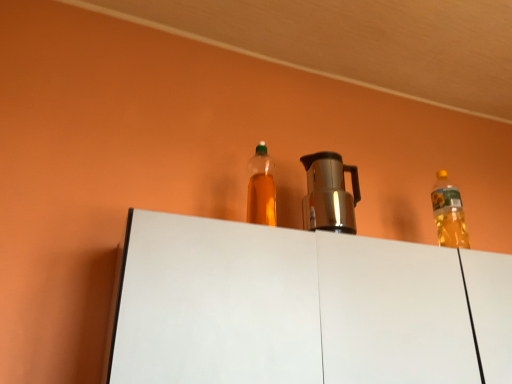
Locate an element on the screen. Image resolution: width=512 pixels, height=384 pixels. satin silver coffee pot at center is located at coordinates (329, 194).

Does translucent plastic bottle at center have a greater height compared to white matte cabinet at center?

No.

How many degrees apart are the facing directions of translucent plastic bottle at center and white matte cabinet at center?

The angle between the facing direction of translucent plastic bottle at center and the facing direction of white matte cabinet at center is 0.877 degrees.

Is translucent plastic bottle at center thinner than white matte cabinet at center?

Indeed, translucent plastic bottle at center has a lesser width compared to white matte cabinet at center.

From a real-world perspective, is translucent plastic bottle at center on top of white matte cabinet at center?

Yes, from a real-world perspective, translucent plastic bottle at center is on top of white matte cabinet at center.

Who is smaller, translucent plastic bottle at center or satin silver coffee pot at center?

Smaller between the two is translucent plastic bottle at center.

Can you tell me how much translucent plastic bottle at center and satin silver coffee pot at center differ in facing direction?

The facing directions of translucent plastic bottle at center and satin silver coffee pot at center are 0.551 degrees apart.

From the picture: From the image's perspective, is translucent plastic bottle at center positioned above or below satin silver coffee pot at center?

Based on their image positions, translucent plastic bottle at center is located above satin silver coffee pot at center.

Is translucent plastic bottle at center in front of or behind satin silver coffee pot at center in the image?

translucent plastic bottle at center is positioned closer to the viewer than satin silver coffee pot at center.

Is white matte cabinet at center looking in the opposite direction of satin silver coffee pot at center?

That's not correct — white matte cabinet at center is not looking away from satin silver coffee pot at center.

Which of these two, white matte cabinet at center or satin silver coffee pot at center, is thinner?

satin silver coffee pot at center.

Which object is further away from the camera, white matte cabinet at center or satin silver coffee pot at center?

satin silver coffee pot at center is further from the camera.

Considering the relative sizes of white matte cabinet at center and satin silver coffee pot at center in the image provided, is white matte cabinet at center shorter than satin silver coffee pot at center?

No.

From a real-world perspective, is satin silver coffee pot at center above or below white matte cabinet at center?

Clearly, from a real-world perspective, satin silver coffee pot at center is above white matte cabinet at center.

Based on the photo, can you confirm if satin silver coffee pot at center is positioned to the right of white matte cabinet at center?

No, satin silver coffee pot at center is not to the right of white matte cabinet at center.

In the scene shown: Is satin silver coffee pot at center beside white matte cabinet at center?

No.

Does satin silver coffee pot at center have a greater width compared to white matte cabinet at center?

No, satin silver coffee pot at center is not wider than white matte cabinet at center.

Locate an element on the screen. This screenshot has width=512, height=384. bottle behind the white matte cabinet at center is located at coordinates click(x=261, y=189).

How many degrees apart are the facing directions of white matte cabinet at center and translucent plastic bottle at center?

The angle between the facing direction of white matte cabinet at center and the facing direction of translucent plastic bottle at center is 0.877 degrees.

Is white matte cabinet at center positioned before translucent plastic bottle at center?

Yes, white matte cabinet at center is closer to the viewer.

Is satin silver coffee pot at center positioned beyond the bounds of translucent plastic bottle at center?

Yes, satin silver coffee pot at center is not within translucent plastic bottle at center.

From the picture: Which is farther, (307, 199) or (260, 155)?

Point (307, 199)

Can you confirm if satin silver coffee pot at center is taller than translucent plastic bottle at center?

No, satin silver coffee pot at center is not taller than translucent plastic bottle at center.

Is there a large distance between satin silver coffee pot at center and translucent plastic bottle at center?

They are positioned close to each other.

Locate an element on the screen. The width and height of the screenshot is (512, 384). bottle on the left of the white matte cabinet at center is located at coordinates (261, 189).

Identify the location of coffeepot below the translucent plastic bottle at center (from the image's perspective). (329, 194).

Considering their positions, is satin silver coffee pot at center positioned further to translucent plastic bottle at center than white matte cabinet at center?

satin silver coffee pot at center.

When comparing their distances from white matte cabinet at center, does translucent plastic bottle at center or satin silver coffee pot at center seem further?

Among the two, satin silver coffee pot at center is located further to white matte cabinet at center.

When comparing their distances from white matte cabinet at center, does satin silver coffee pot at center or translucent plastic bottle at center seem closer?

translucent plastic bottle at center lies closer to white matte cabinet at center than the other object.

Considering their positions, is translucent plastic bottle at center positioned further to satin silver coffee pot at center than white matte cabinet at center?

white matte cabinet at center.

From the image, which object appears to be farther from satin silver coffee pot at center, white matte cabinet at center or translucent plastic bottle at center?

Based on the image, white matte cabinet at center appears to be further to satin silver coffee pot at center.

Looking at the image, which one is located closer to translucent plastic bottle at center, white matte cabinet at center or satin silver coffee pot at center?

white matte cabinet at center lies closer to translucent plastic bottle at center than the other object.

The height and width of the screenshot is (384, 512). Find the location of `coffeepot between translucent plastic bottle at center and white matte cabinet at center vertically`. coffeepot between translucent plastic bottle at center and white matte cabinet at center vertically is located at coordinates (329, 194).